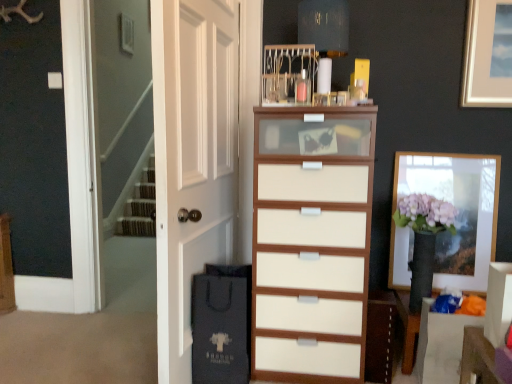
Question: Is white wood chest of drawers at center surrounding matte black shopping bag at lower left?

Choices:
 (A) yes
 (B) no

Answer: (B)

Question: From a real-world perspective, does white wood chest of drawers at center sit lower than matte black shopping bag at lower left?

Choices:
 (A) no
 (B) yes

Answer: (A)

Question: Is white wood chest of drawers at center oriented away from matte black shopping bag at lower left?

Choices:
 (A) yes
 (B) no

Answer: (B)

Question: Is white wood chest of drawers at center positioned behind matte black shopping bag at lower left?

Choices:
 (A) yes
 (B) no

Answer: (B)

Question: Does white wood chest of drawers at center have a greater height compared to matte black shopping bag at lower left?

Choices:
 (A) no
 (B) yes

Answer: (B)

Question: Does white wood chest of drawers at center lie in front of matte black shopping bag at lower left?

Choices:
 (A) yes
 (B) no

Answer: (A)

Question: Is the surface of wooden picture frame at right in direct contact with matte black shopping bag at lower left?

Choices:
 (A) no
 (B) yes

Answer: (A)

Question: Does wooden picture frame at right have a smaller size compared to matte black shopping bag at lower left?

Choices:
 (A) yes
 (B) no

Answer: (A)

Question: From the image's perspective, is wooden picture frame at right over matte black shopping bag at lower left?

Choices:
 (A) yes
 (B) no

Answer: (A)

Question: From a real-world perspective, is wooden picture frame at right beneath matte black shopping bag at lower left?

Choices:
 (A) yes
 (B) no

Answer: (B)

Question: Considering the relative sizes of wooden picture frame at right and matte black shopping bag at lower left in the image provided, is wooden picture frame at right shorter than matte black shopping bag at lower left?

Choices:
 (A) no
 (B) yes

Answer: (A)

Question: From the image's perspective, would you say wooden picture frame at right is shown under matte black shopping bag at lower left?

Choices:
 (A) yes
 (B) no

Answer: (B)

Question: Is white wood cabinet at center facing towards matte black shopping bag at lower left?

Choices:
 (A) yes
 (B) no

Answer: (B)